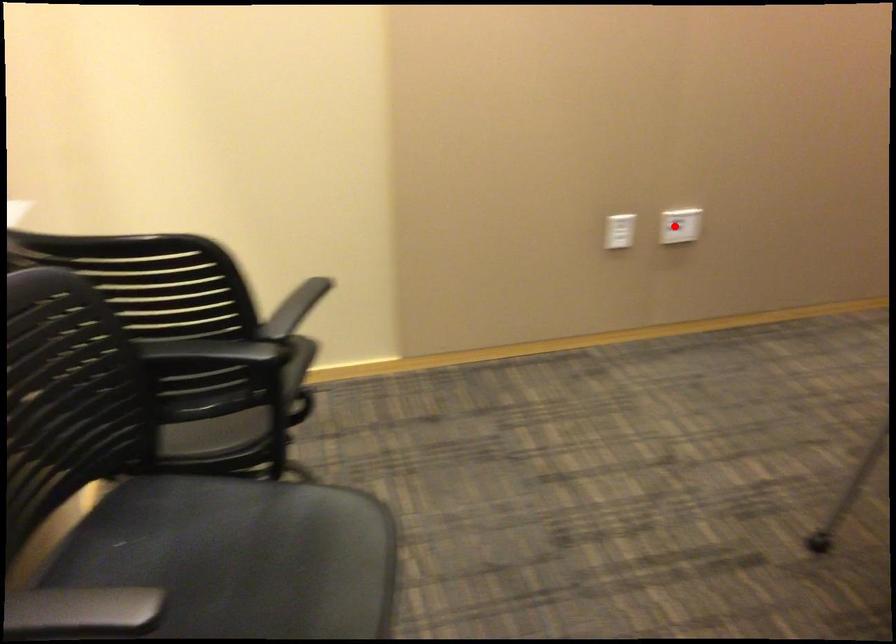
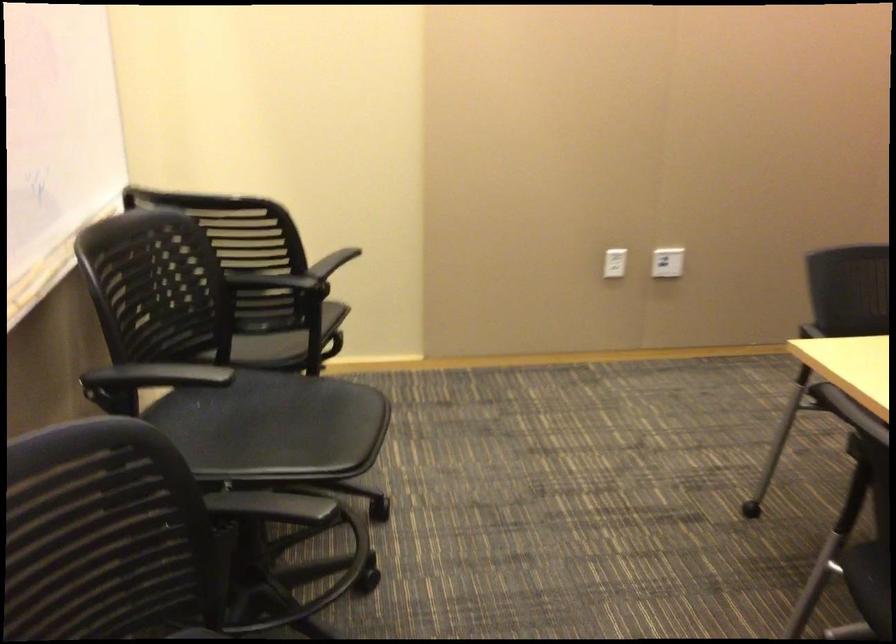
Where in the second image is the point corresponding to the highlighted location from the first image?

(667, 261)